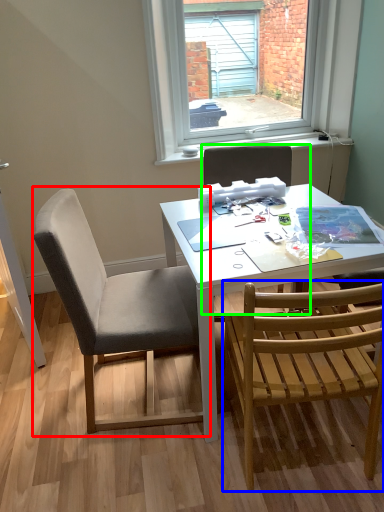
Question: Which object is the farthest from chair (highlighted by a red box)? Choose among these: chair (highlighted by a blue box) or chair (highlighted by a green box).

Choices:
 (A) chair
 (B) chair

Answer: (B)